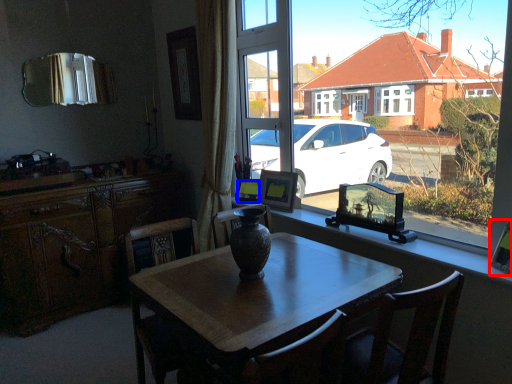
Question: Which object is closer to the camera taking this photo, picture frame (highlighted by a red box) or picture frame (highlighted by a blue box)?

Choices:
 (A) picture frame
 (B) picture frame

Answer: (A)